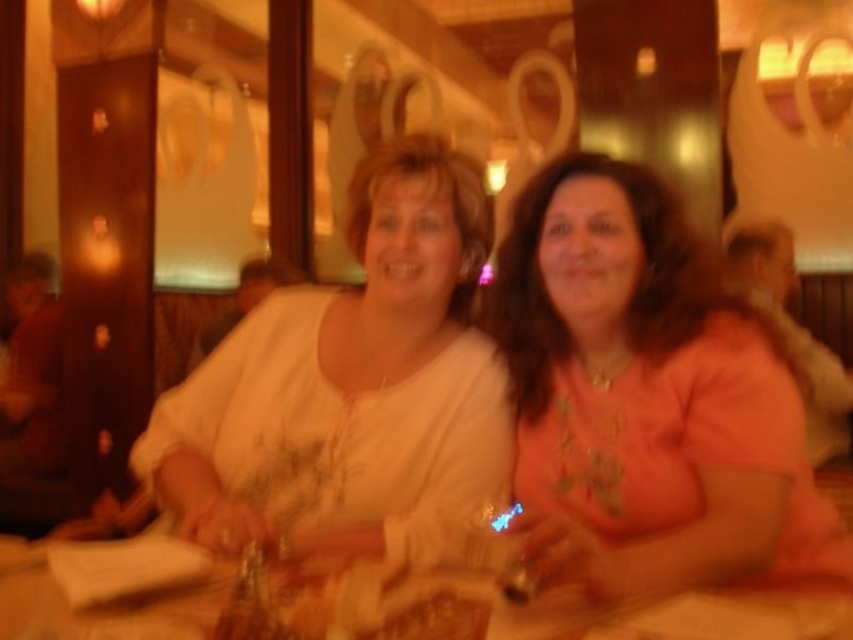
Who is lower down, orange matte shirt at right or white satin blouse at center?

orange matte shirt at right

At what (x,y) coordinates should I click in order to perform the action: click on orange matte shirt at right. Please return your answer as a coordinate pair (x, y). The height and width of the screenshot is (640, 853). Looking at the image, I should click on (648, 400).

Which of these two, orange matte shirt at right or wooden table at center, stands shorter?

Standing shorter between the two is wooden table at center.

Is orange matte shirt at right smaller than wooden table at center?

No.

Who is more forward, (718, 476) or (178, 595)?

Positioned in front is point (178, 595).

The width and height of the screenshot is (853, 640). Identify the location of orange matte shirt at right. (648, 400).

Does white satin blouse at center have a greater width compared to wooden table at center?

No.

Is white satin blouse at center to the right of wooden table at center from the viewer's perspective?

Incorrect, white satin blouse at center is not on the right side of wooden table at center.

Identify the location of white satin blouse at center. (352, 388).

The image size is (853, 640). In order to click on white satin blouse at center in this screenshot , I will do `click(352, 388)`.